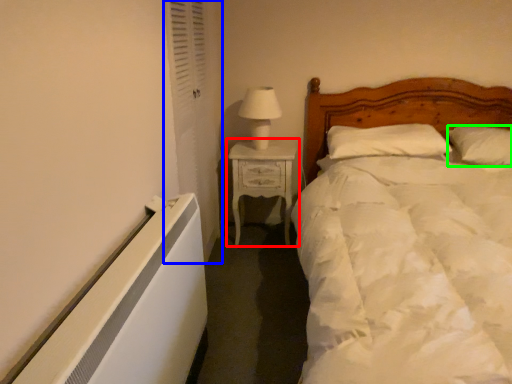
Question: Which object is positioned farthest from nightstand (highlighted by a red box)? Select from curtain (highlighted by a blue box) and pillow (highlighted by a green box).

Choices:
 (A) curtain
 (B) pillow

Answer: (B)